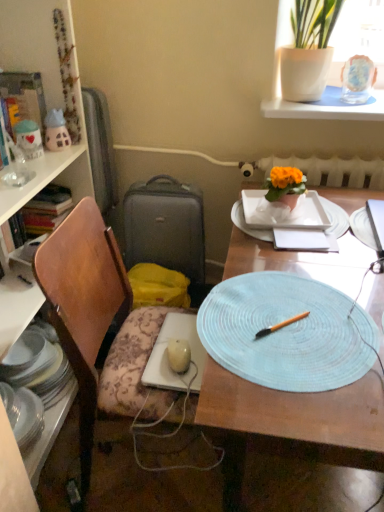
Locate an element on the screen. This screenshot has height=512, width=384. blank space situated above white ceramic plate at center, the first plate from the top (from a real-world perspective) is located at coordinates (295, 214).